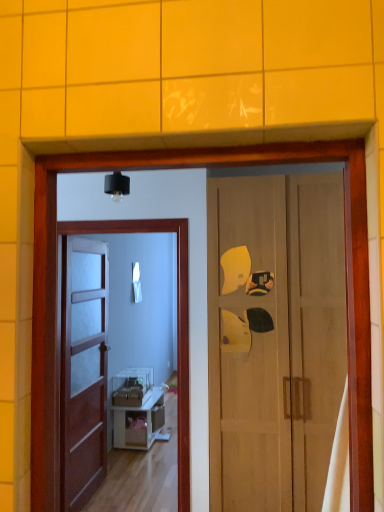
Question: Is clear glass screen door at center smaller than wooden door at right, which ranks as the 1th door in right-to-left order?

Choices:
 (A) no
 (B) yes

Answer: (B)

Question: Is clear glass screen door at center aimed at wooden door at right, the 2th door positioned from the left?

Choices:
 (A) yes
 (B) no

Answer: (B)

Question: Does clear glass screen door at center have a greater width compared to wooden door at right, the 2th door positioned from the left?

Choices:
 (A) yes
 (B) no

Answer: (B)

Question: Is the position of clear glass screen door at center more distant than that of wooden door at right, which ranks as the 1th door in right-to-left order?

Choices:
 (A) yes
 (B) no

Answer: (A)

Question: Is clear glass screen door at center beside wooden door at right, which ranks as the 1th door in right-to-left order?

Choices:
 (A) yes
 (B) no

Answer: (B)

Question: Which is correct: wooden door at right, the 2th door positioned from the left, is inside clear glass screen door at center, or outside of it?

Choices:
 (A) inside
 (B) outside

Answer: (B)

Question: In the image, is wooden door at right, which ranks as the 1th door in right-to-left order, on the left side or the right side of clear glass screen door at center?

Choices:
 (A) left
 (B) right

Answer: (B)

Question: Is point (288, 311) closer or farther from the camera than point (183, 391)?

Choices:
 (A) closer
 (B) farther

Answer: (A)

Question: Looking at the image, does wooden door at right, which ranks as the 1th door in right-to-left order, seem bigger or smaller compared to clear glass screen door at center?

Choices:
 (A) small
 (B) big

Answer: (B)

Question: Is brown wooden door at center, the 1th door when ordered from left to right, inside the boundaries of clear glass screen door at center, or outside?

Choices:
 (A) outside
 (B) inside

Answer: (A)

Question: From the image's perspective, relative to clear glass screen door at center, is brown wooden door at center, the 1th door when ordered from left to right, above or below?

Choices:
 (A) below
 (B) above

Answer: (A)

Question: Is point [x=86, y=325] closer or farther from the camera than point [x=180, y=499]?

Choices:
 (A) farther
 (B) closer

Answer: (A)

Question: From a real-world perspective, is brown wooden door at center, the 1th door when ordered from left to right, physically located above or below clear glass screen door at center?

Choices:
 (A) above
 (B) below

Answer: (B)

Question: From the image's perspective, is clear glass screen door at center located above or below white glossy mirror at center?

Choices:
 (A) below
 (B) above

Answer: (A)

Question: Considering the relative positions of clear glass screen door at center and white glossy mirror at center in the image provided, is clear glass screen door at center to the left or to the right of white glossy mirror at center?

Choices:
 (A) right
 (B) left

Answer: (A)